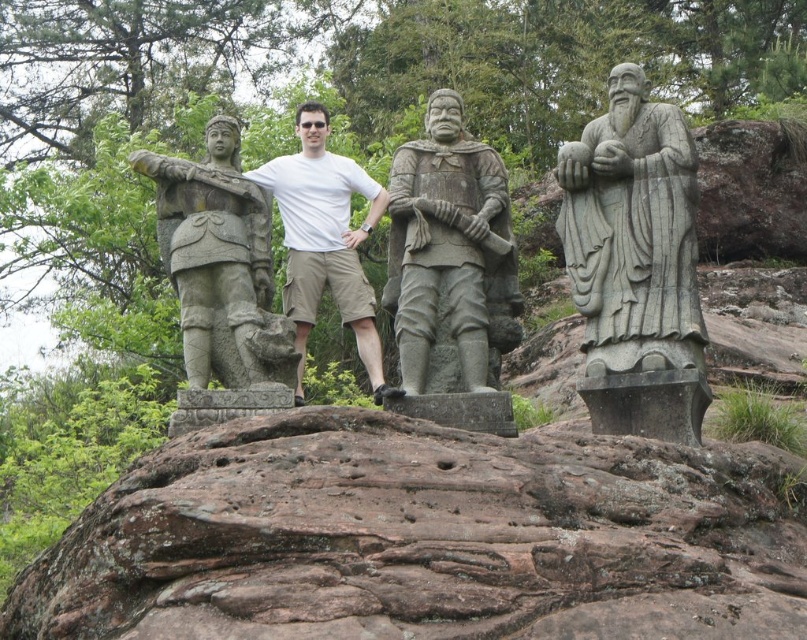
Question: In this image, where is gray stone statue at right located relative to white matte shirt at center?

Choices:
 (A) right
 (B) left

Answer: (A)

Question: Which point appears closest to the camera in this image?

Choices:
 (A) (199, 333)
 (B) (358, 241)
 (C) (312, 109)

Answer: (A)

Question: Which object is closer to the camera taking this photo?

Choices:
 (A) gray stone hand at center
 (B) brown stone rock at center
 (C) gray stone statue at right

Answer: (B)

Question: Is gray stone statue at center below white matte shirt at center?

Choices:
 (A) no
 (B) yes

Answer: (A)

Question: Can you confirm if gray stone hand at center is positioned to the right of matte stone hand at center?

Choices:
 (A) no
 (B) yes

Answer: (B)

Question: Which object is the farthest from the gray stone hand at center?

Choices:
 (A) gray stone statue at right
 (B) white matte shirt at center
 (C) stone warrior at left
 (D) matte stone hand at center

Answer: (C)